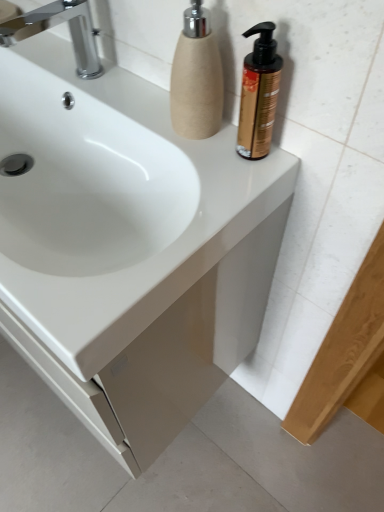
What do you see at coordinates (196, 77) in the screenshot?
I see `beige textured soap dispenser at upper right, which is the first soap dispenser in left-to-right order` at bounding box center [196, 77].

Describe the element at coordinates (112, 203) in the screenshot. I see `white glossy sink at center` at that location.

Where is `gold metallic pump bottle at upper right, the first soap dispenser in the right-to-left sequence`? The height and width of the screenshot is (512, 384). gold metallic pump bottle at upper right, the first soap dispenser in the right-to-left sequence is located at coordinates (259, 93).

Identify the location of beige textured soap dispenser at upper right, which is the first soap dispenser in left-to-right order. Image resolution: width=384 pixels, height=512 pixels. (196, 77).

Does chrome metallic faucet at upper left have a lesser width compared to beige textured soap dispenser at upper right, marked as the 2th soap dispenser in a right-to-left arrangement?

No.

Is chrome metallic faucet at upper left to the right of beige textured soap dispenser at upper right, which is the first soap dispenser in left-to-right order, from the viewer's perspective?

No, chrome metallic faucet at upper left is not to the right of beige textured soap dispenser at upper right, which is the first soap dispenser in left-to-right order.

Would you say chrome metallic faucet at upper left is a long distance from beige textured soap dispenser at upper right, which is the first soap dispenser in left-to-right order?

Actually, chrome metallic faucet at upper left and beige textured soap dispenser at upper right, which is the first soap dispenser in left-to-right order, are a little close together.

Is beige textured soap dispenser at upper right, marked as the 2th soap dispenser in a right-to-left arrangement, facing away from white glossy sink at center?

No, beige textured soap dispenser at upper right, marked as the 2th soap dispenser in a right-to-left arrangement, is not facing the opposite direction of white glossy sink at center.

Considering the relative positions of beige textured soap dispenser at upper right, which is the first soap dispenser in left-to-right order, and white glossy sink at center in the image provided, is beige textured soap dispenser at upper right, which is the first soap dispenser in left-to-right order, to the right of white glossy sink at center from the viewer's perspective?

Correct, you'll find beige textured soap dispenser at upper right, which is the first soap dispenser in left-to-right order, to the right of white glossy sink at center.

Does beige textured soap dispenser at upper right, marked as the 2th soap dispenser in a right-to-left arrangement, have a lesser width compared to white glossy sink at center?

Indeed, beige textured soap dispenser at upper right, marked as the 2th soap dispenser in a right-to-left arrangement, has a lesser width compared to white glossy sink at center.

From the image's perspective, does beige textured soap dispenser at upper right, which is the first soap dispenser in left-to-right order, appear lower than white glossy sink at center?

No, from the image's perspective, beige textured soap dispenser at upper right, which is the first soap dispenser in left-to-right order, is not beneath white glossy sink at center.

Considering the positions of point (259, 152) and point (205, 125), is point (259, 152) closer or farther from the camera than point (205, 125)?

Point (259, 152) is closer to the camera than point (205, 125).

From a real-world perspective, is gold metallic pump bottle at upper right, the first soap dispenser in the right-to-left sequence, above or below beige textured soap dispenser at upper right, which is the first soap dispenser in left-to-right order?

In terms of real-world spatial position, gold metallic pump bottle at upper right, the first soap dispenser in the right-to-left sequence, is below beige textured soap dispenser at upper right, which is the first soap dispenser in left-to-right order.

Is gold metallic pump bottle at upper right, the 2th soap dispenser from the left, in contact with beige textured soap dispenser at upper right, marked as the 2th soap dispenser in a right-to-left arrangement?

Yes, gold metallic pump bottle at upper right, the 2th soap dispenser from the left, is in contact with beige textured soap dispenser at upper right, marked as the 2th soap dispenser in a right-to-left arrangement.

Does white glossy sink at center have a lesser width compared to beige textured soap dispenser at upper right, which is the first soap dispenser in left-to-right order?

No.

Is white glossy sink at center facing towards beige textured soap dispenser at upper right, which is the first soap dispenser in left-to-right order?

No, white glossy sink at center is not facing towards beige textured soap dispenser at upper right, which is the first soap dispenser in left-to-right order.

Does white glossy sink at center contain beige textured soap dispenser at upper right, which is the first soap dispenser in left-to-right order?

No, beige textured soap dispenser at upper right, which is the first soap dispenser in left-to-right order, is not a part of white glossy sink at center.

From a real-world perspective, who is located higher, white glossy sink at center or beige textured soap dispenser at upper right, marked as the 2th soap dispenser in a right-to-left arrangement?

beige textured soap dispenser at upper right, marked as the 2th soap dispenser in a right-to-left arrangement, is physically above.

Does gold metallic pump bottle at upper right, the 2th soap dispenser from the left, have a larger size compared to white glossy sink at center?

Incorrect, gold metallic pump bottle at upper right, the 2th soap dispenser from the left, is not larger than white glossy sink at center.

Is gold metallic pump bottle at upper right, the first soap dispenser in the right-to-left sequence, directly adjacent to white glossy sink at center?

No, gold metallic pump bottle at upper right, the first soap dispenser in the right-to-left sequence, is not touching white glossy sink at center.

Can you confirm if gold metallic pump bottle at upper right, the 2th soap dispenser from the left, is shorter than white glossy sink at center?

In fact, gold metallic pump bottle at upper right, the 2th soap dispenser from the left, may be taller than white glossy sink at center.

From a real-world perspective, which object rests below the other?

In real-world perspective, white glossy sink at center is lower.

Is white glossy sink at center not close to chrome metallic faucet at upper left?

No, there isn't a large distance between white glossy sink at center and chrome metallic faucet at upper left.

Does point (122, 277) come behind point (85, 57)?

No, it is in front of (85, 57).

Which of these two, white glossy sink at center or chrome metallic faucet at upper left, is wider?

Wider between the two is white glossy sink at center.

In the scene shown: From the image's perspective, which one is positioned higher, white glossy sink at center or chrome metallic faucet at upper left?

chrome metallic faucet at upper left, from the image's perspective.

From a real-world perspective, is beige textured soap dispenser at upper right, which is the first soap dispenser in left-to-right order, located higher than chrome metallic faucet at upper left?

Yes, from a real-world perspective, beige textured soap dispenser at upper right, which is the first soap dispenser in left-to-right order, is on top of chrome metallic faucet at upper left.

Considering the positions of objects beige textured soap dispenser at upper right, marked as the 2th soap dispenser in a right-to-left arrangement, and chrome metallic faucet at upper left in the image provided, who is in front, beige textured soap dispenser at upper right, marked as the 2th soap dispenser in a right-to-left arrangement, or chrome metallic faucet at upper left?

beige textured soap dispenser at upper right, marked as the 2th soap dispenser in a right-to-left arrangement, is closer to the camera.

Does beige textured soap dispenser at upper right, marked as the 2th soap dispenser in a right-to-left arrangement, have a lesser height compared to chrome metallic faucet at upper left?

In fact, beige textured soap dispenser at upper right, marked as the 2th soap dispenser in a right-to-left arrangement, may be taller than chrome metallic faucet at upper left.

Is chrome metallic faucet at upper left inside beige textured soap dispenser at upper right, which is the first soap dispenser in left-to-right order?

Actually, chrome metallic faucet at upper left is outside beige textured soap dispenser at upper right, which is the first soap dispenser in left-to-right order.

Locate an element on the screen. The width and height of the screenshot is (384, 512). tap that appears behind the beige textured soap dispenser at upper right, which is the first soap dispenser in left-to-right order is located at coordinates (56, 24).

Find the location of a particular element. The width and height of the screenshot is (384, 512). the 2nd soap dispenser located above the white glossy sink at center (from a real-world perspective) is located at coordinates (196, 77).

Estimate the real-world distances between objects in this image. Which object is further from white glossy sink at center, chrome metallic faucet at upper left or gold metallic pump bottle at upper right, the 2th soap dispenser from the left?

gold metallic pump bottle at upper right, the 2th soap dispenser from the left, is further to white glossy sink at center.

Which object lies nearer to the anchor point chrome metallic faucet at upper left, beige textured soap dispenser at upper right, which is the first soap dispenser in left-to-right order, or white glossy sink at center?

white glossy sink at center is positioned closer to the anchor chrome metallic faucet at upper left.

Estimate the real-world distances between objects in this image. Which object is closer to chrome metallic faucet at upper left, gold metallic pump bottle at upper right, the 2th soap dispenser from the left, or beige textured soap dispenser at upper right, which is the first soap dispenser in left-to-right order?

The object closer to chrome metallic faucet at upper left is beige textured soap dispenser at upper right, which is the first soap dispenser in left-to-right order.

Considering their positions, is white glossy sink at center positioned closer to chrome metallic faucet at upper left than beige textured soap dispenser at upper right, which is the first soap dispenser in left-to-right order?

Based on the image, white glossy sink at center appears to be nearer to chrome metallic faucet at upper left.

Considering their positions, is white glossy sink at center positioned further to gold metallic pump bottle at upper right, the 2th soap dispenser from the left, than chrome metallic faucet at upper left?

chrome metallic faucet at upper left is further to gold metallic pump bottle at upper right, the 2th soap dispenser from the left.

Considering their positions, is chrome metallic faucet at upper left positioned closer to beige textured soap dispenser at upper right, which is the first soap dispenser in left-to-right order, than gold metallic pump bottle at upper right, the 2th soap dispenser from the left?

The object closer to beige textured soap dispenser at upper right, which is the first soap dispenser in left-to-right order, is gold metallic pump bottle at upper right, the 2th soap dispenser from the left.

Looking at the image, which one is located further to white glossy sink at center, beige textured soap dispenser at upper right, marked as the 2th soap dispenser in a right-to-left arrangement, or chrome metallic faucet at upper left?

Among the two, chrome metallic faucet at upper left is located further to white glossy sink at center.

Looking at the image, which one is located further to gold metallic pump bottle at upper right, the first soap dispenser in the right-to-left sequence, beige textured soap dispenser at upper right, marked as the 2th soap dispenser in a right-to-left arrangement, or chrome metallic faucet at upper left?

chrome metallic faucet at upper left lies further to gold metallic pump bottle at upper right, the first soap dispenser in the right-to-left sequence, than the other object.

The image size is (384, 512). In order to click on tap situated between white glossy sink at center and gold metallic pump bottle at upper right, the first soap dispenser in the right-to-left sequence, from left to right in this screenshot , I will do `click(56, 24)`.

The width and height of the screenshot is (384, 512). What are the coordinates of `tap between white glossy sink at center and beige textured soap dispenser at upper right, marked as the 2th soap dispenser in a right-to-left arrangement` in the screenshot? It's located at (56, 24).

Where is `soap dispenser between chrome metallic faucet at upper left and gold metallic pump bottle at upper right, the first soap dispenser in the right-to-left sequence`? The image size is (384, 512). soap dispenser between chrome metallic faucet at upper left and gold metallic pump bottle at upper right, the first soap dispenser in the right-to-left sequence is located at coordinates (196, 77).

The height and width of the screenshot is (512, 384). In order to click on soap dispenser situated between white glossy sink at center and gold metallic pump bottle at upper right, the 2th soap dispenser from the left, from left to right in this screenshot , I will do `click(196, 77)`.